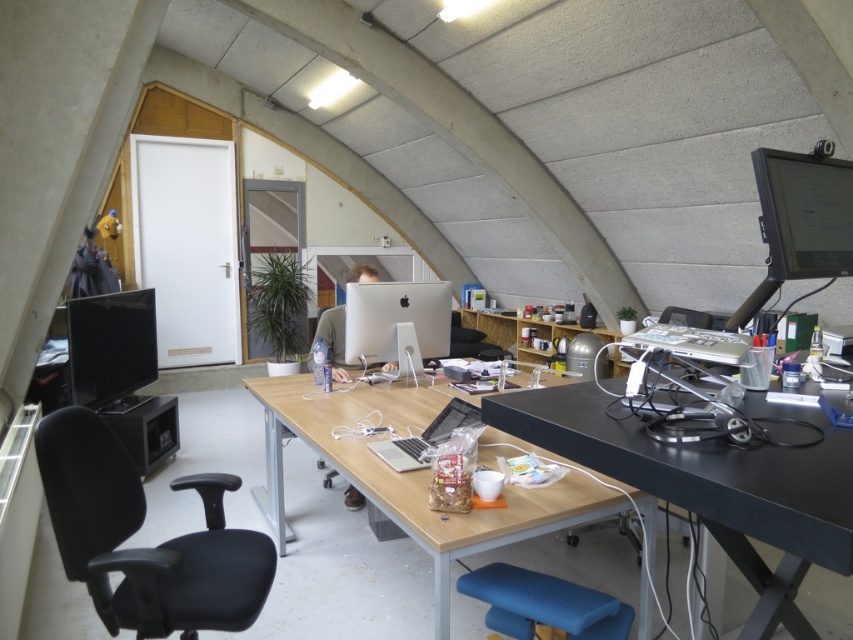
You are a delivery person who needs to place a package on the desk. The package is 6 feet long. Can you place it horizontally between the blue fabric stool at lower center and the satin silver monitor at center without bending it?

The distance between the blue fabric stool at lower center and the satin silver monitor at center is 5.70 feet. Since the package is 6 feet long, it cannot be placed horizontally between them without bending it.

You are standing in the workspace and want to pick up an item from the desk. There are two points marked on the desk surface, one at coordinate point (799, 532) and another at point (102, 515). Which point is closer to you?

Point (799, 532) is closer to the camera than point (102, 515), so the point at (799, 532) is closer to you.

You are standing in the workspace shown in the image. You need to place a new item on the black matte table at right. Where exactly should you place it based on the coordinates provided?

The black matte table at right should be placed at the 2D coordinates point (715,483) as specified in the description.